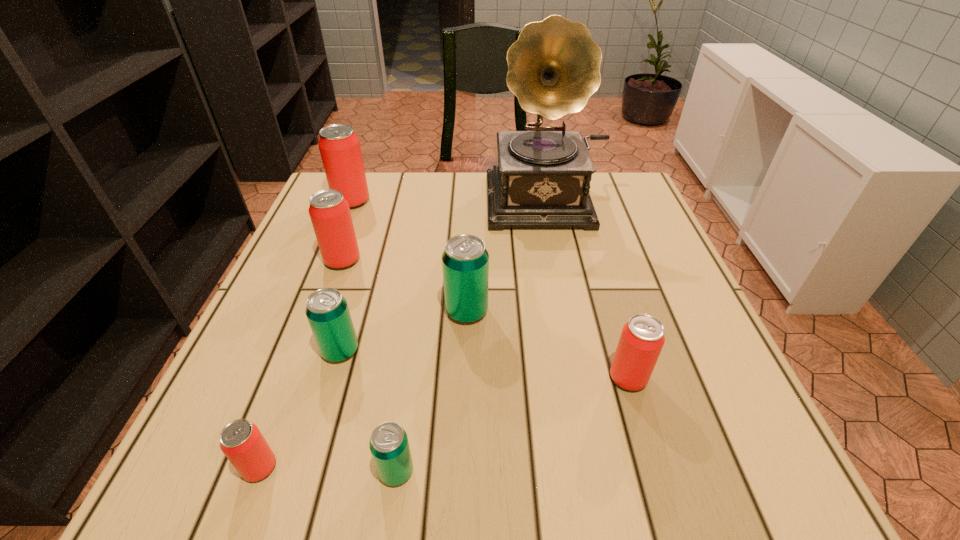
Identify the location of vacant area between the second farthest beer can and the smallest red beer can. The width and height of the screenshot is (960, 540). (301, 364).

Select which object appears as the sixth closest to the second beer can from right to left. Please provide its 2D coordinates. Your answer should be formatted as a tuple, i.e. [(x, y)], where the tuple contains the x and y coordinates of a point satisfying the conditions above.

[(241, 441)]

Select which object appears as the fourth closest to the second farthest teal beer can. Please provide its 2D coordinates. Your answer should be formatted as a tuple, i.e. [(x, y)], where the tuple contains the x and y coordinates of a point satisfying the conditions above.

[(330, 215)]

The width and height of the screenshot is (960, 540). Identify the location of beer can object that ranks as the third closest to the sixth nearest beer can. (465, 261).

Where is `beer can that is the third closest one to the record player`? Image resolution: width=960 pixels, height=540 pixels. beer can that is the third closest one to the record player is located at coordinates (339, 146).

Where is `red beer can object that ranks as the fourth closest to the second biggest teal beer can`? This screenshot has width=960, height=540. red beer can object that ranks as the fourth closest to the second biggest teal beer can is located at coordinates pyautogui.click(x=642, y=338).

The width and height of the screenshot is (960, 540). What are the coordinates of `red beer can that is the second closest to the smallest red beer can` in the screenshot? It's located at (642, 338).

At what (x,y) coordinates should I click in order to perform the action: click on teal beer can object that ranks as the second closest to the second teal beer can from left to right. Please return your answer as a coordinate pair (x, y). This screenshot has height=540, width=960. Looking at the image, I should click on (465, 261).

Find the location of a particular element. teal beer can that is the second nearest to the biggest red beer can is located at coordinates (327, 311).

Locate an element on the screen. free location that satisfies the following two spatial constraints: 1. on the front side of the third smallest red beer can; 2. on the left side of the tallest beer can is located at coordinates (328, 260).